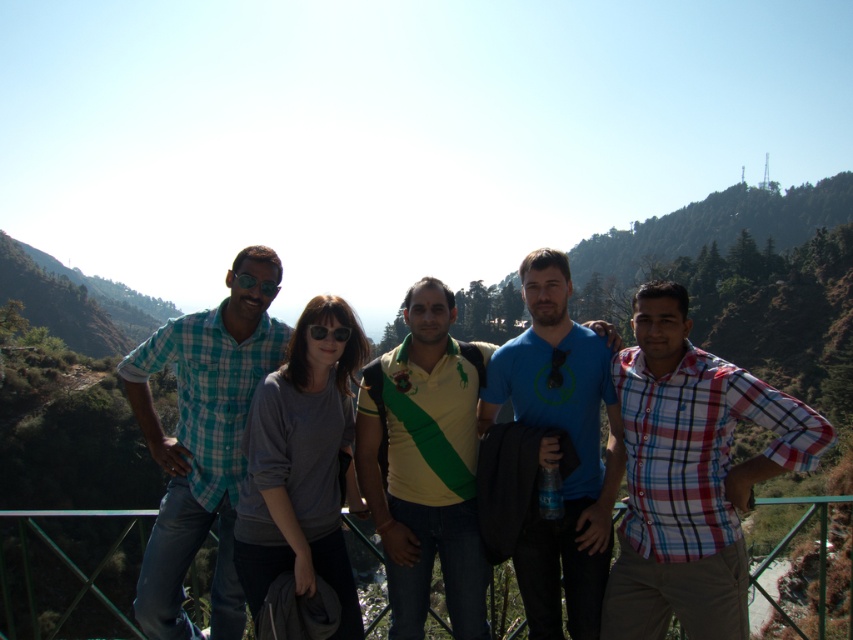
How distant is yellow-green jersey at center from green metallic rail at center?

yellow-green jersey at center is 16.61 meters away from green metallic rail at center.

Is yellow-green jersey at center behind green metallic rail at center?

Yes, yellow-green jersey at center is further from the viewer.

Who is more forward, (399, 515) or (100, 512)?

Point (100, 512) is in front.

The width and height of the screenshot is (853, 640). I want to click on yellow-green jersey at center, so click(x=425, y=465).

Who is higher up, plaid cotton shirt at right or teal plaid shirt at left?

teal plaid shirt at left

Which is behind, point (689, 424) or point (271, 292)?

The point (271, 292) is more distant.

Where is `plaid cotton shirt at right`? plaid cotton shirt at right is located at coordinates (691, 476).

This screenshot has width=853, height=640. Describe the element at coordinates (691, 476) in the screenshot. I see `plaid cotton shirt at right` at that location.

Looking at this image, does plaid cotton shirt at right appear over green metallic rail at center?

Correct, plaid cotton shirt at right is located above green metallic rail at center.

Find the location of `plaid cotton shirt at right`. plaid cotton shirt at right is located at coordinates (691, 476).